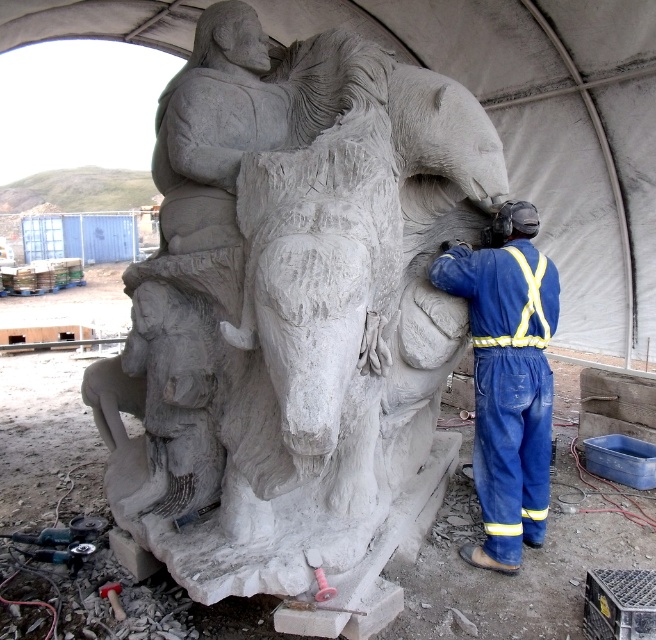
Can you confirm if white stone horse at center is positioned above blue fabric jumpsuit at right?

Correct, white stone horse at center is located above blue fabric jumpsuit at right.

Is white stone horse at center below blue fabric jumpsuit at right?

No.

Describe the element at coordinates (289, 304) in the screenshot. I see `white stone horse at center` at that location.

This screenshot has height=640, width=656. I want to click on white stone horse at center, so click(289, 304).